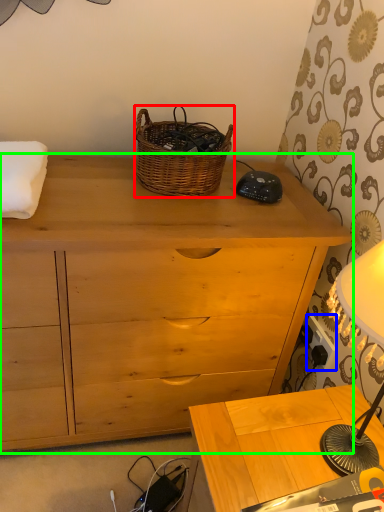
Question: Which object is positioned farthest from picnic basket (highlighted by a red box)? Select from power outlet (highlighted by a blue box) and chest of drawers (highlighted by a green box).

Choices:
 (A) power outlet
 (B) chest of drawers

Answer: (A)